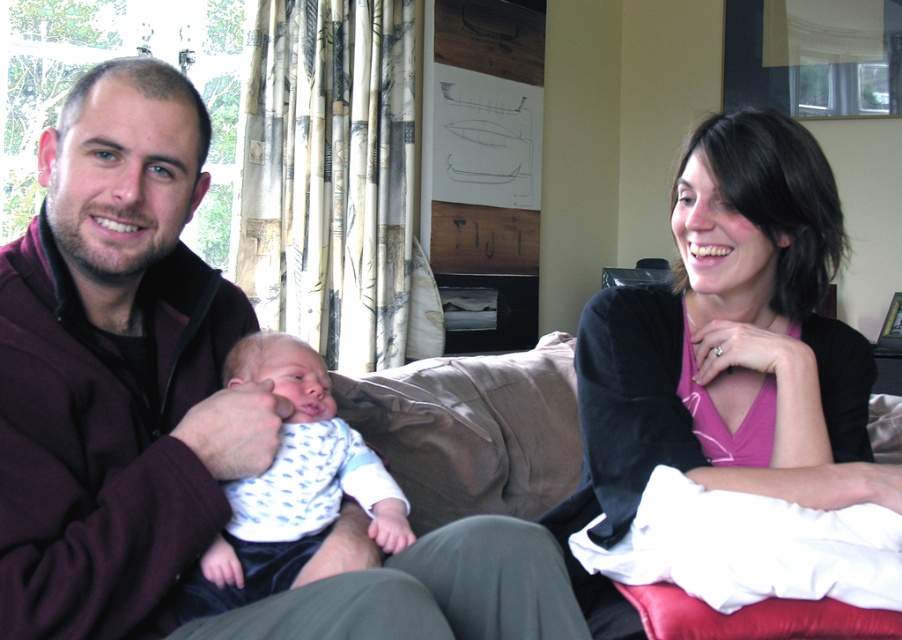
You are a tailor who needs to determine which item requires more fabric to make between the maroon fleece jacket at left and the pink matte shirt at center. Which one would need more fabric?

The maroon fleece jacket at left requires more fabric because it is bigger than the pink matte shirt at center.

You are a photographer setting up for a family portrait. The maroon fleece jacket at left and the pink matte shirt at center are part of the setup. You need to position a small prop between them. What is the minimum width the prop should have to fit snugly between the two items without overlapping?

The minimum width the prop should have is 19.36 inches to fit snugly between the maroon fleece jacket at left and the pink matte shirt at center without overlapping.

You are designing a new clothing line and need to compare the sizes of two fabrics. You have a maroon fleece jacket at left and a white dotted fabric at center. Which fabric is bigger in size?

The maroon fleece jacket at left is larger in size than the white dotted fabric at center.